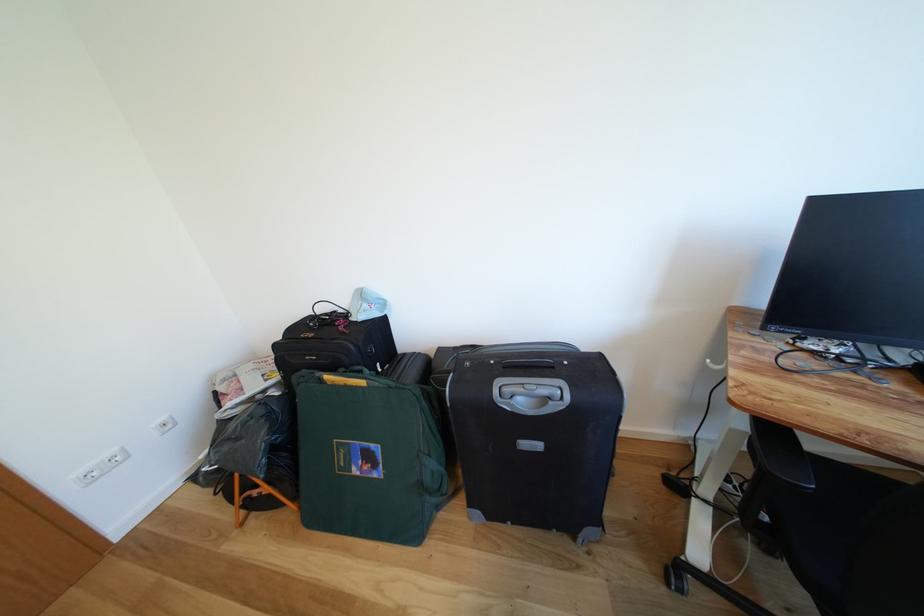
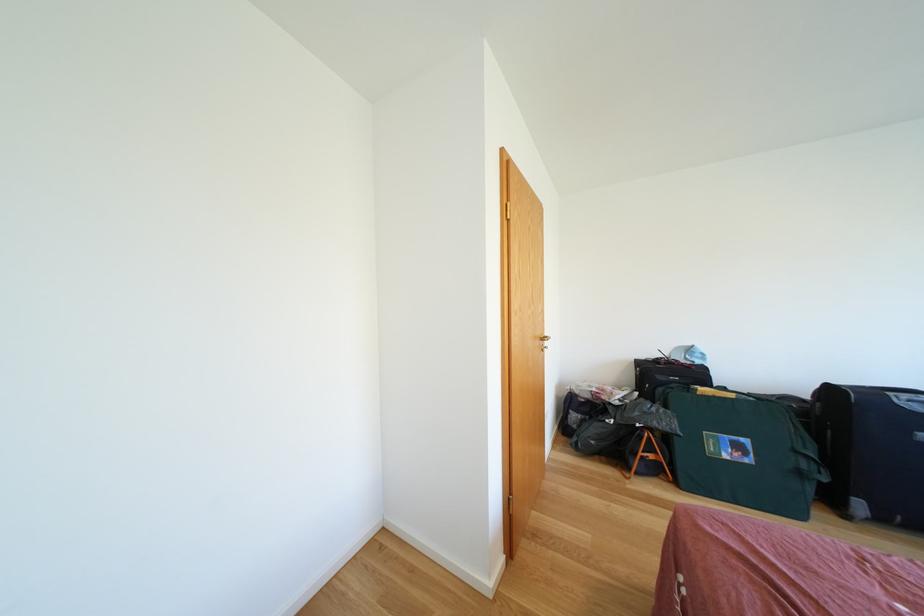
The point at (x=371, y=387) is marked in the first image. Where is the corresponding point in the second image?

(739, 400)